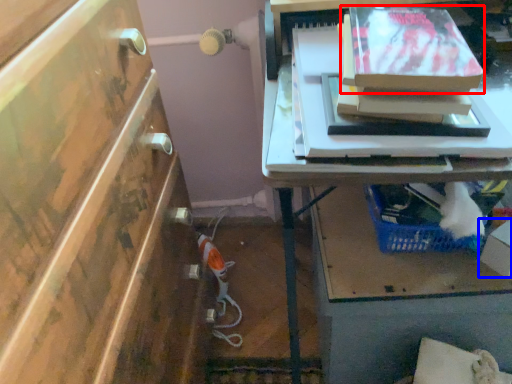
Question: Which of the following is the closest to the observer, storage box (highlighted by a red box) or box (highlighted by a blue box)?

Choices:
 (A) storage box
 (B) box

Answer: (A)